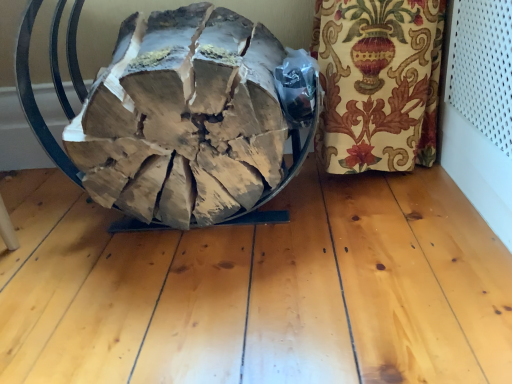
Question: Should I look upward or downward to see natural wood firewood at center?

Choices:
 (A) up
 (B) down

Answer: (A)